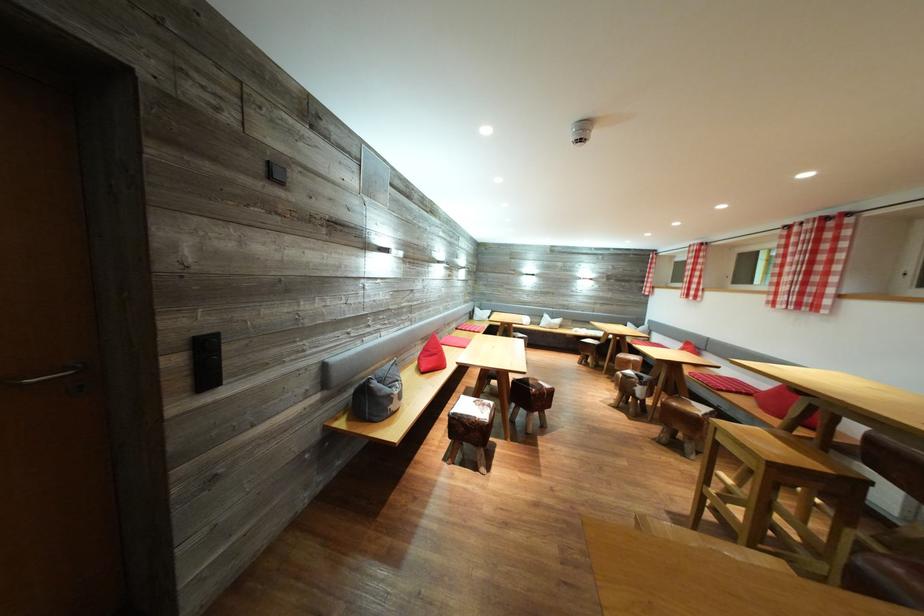
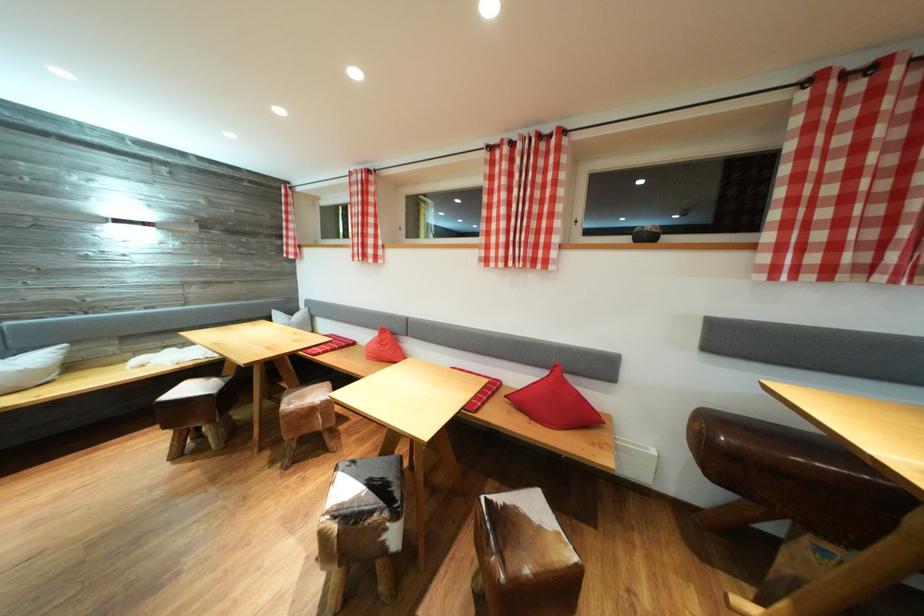
The point at (780, 309) is marked in the first image. Where is the corresponding point in the second image?

(492, 265)